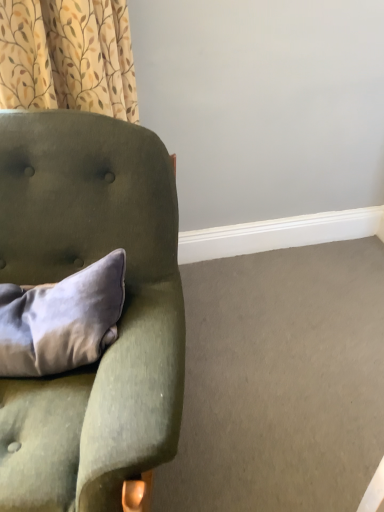
Measure the distance between point (73, 347) and camera.

38.54 inches.

At what (x,y) coordinates should I click in order to perform the action: click on satin gray pillow at left. Please return your answer as a coordinate pair (x, y). Looking at the image, I should click on (61, 320).

At what (x,y) coordinates should I click in order to perform the action: click on velvet green armchair at left. Please return your answer as a coordinate pair (x, y). The width and height of the screenshot is (384, 512). Looking at the image, I should click on (119, 320).

Which is more to the left, velvet green armchair at left or patterned fabric curtain at upper left?

From the viewer's perspective, velvet green armchair at left appears more on the left side.

You are a GUI agent. You are given a task and a screenshot of the screen. Output one action in this format:
    pyautogui.click(x=<x>, y=<y>)
    Task: Click on the curtain above the velvet green armchair at left (from a real-world perspective)
    
    Given the screenshot: What is the action you would take?
    pyautogui.click(x=67, y=56)

Can you confirm if velvet green armchair at left is shorter than patterned fabric curtain at upper left?

No.

Is velvet green armchair at left placed right next to patterned fabric curtain at upper left?

No, velvet green armchair at left is not making contact with patterned fabric curtain at upper left.

From the image's perspective, is velvet green armchair at left located above or below satin gray pillow at left?

Based on their image positions, velvet green armchair at left is located beneath satin gray pillow at left.

From a real-world perspective, between velvet green armchair at left and satin gray pillow at left, who is vertically higher?

satin gray pillow at left is physically above.

From their relative heights in the image, would you say velvet green armchair at left is taller or shorter than satin gray pillow at left?

Considering their sizes, velvet green armchair at left has more height than satin gray pillow at left.

Which object is closer to the camera taking this photo, velvet green armchair at left or satin gray pillow at left?

velvet green armchair at left.

From a real-world perspective, is patterned fabric curtain at upper left positioned under satin gray pillow at left based on gravity?

No.

Is patterned fabric curtain at upper left oriented away from satin gray pillow at left?

No, patterned fabric curtain at upper left's orientation is not away from satin gray pillow at left.

Can you tell me how much patterned fabric curtain at upper left and satin gray pillow at left differ in facing direction?

patterned fabric curtain at upper left and satin gray pillow at left are facing 16 degrees away from each other.

From the image's perspective, does patterned fabric curtain at upper left appear lower than satin gray pillow at left?

No, from the image's perspective, patterned fabric curtain at upper left is not beneath satin gray pillow at left.

Considering the sizes of satin gray pillow at left and velvet green armchair at left in the image, is satin gray pillow at left wider or thinner than velvet green armchair at left?

Clearly, satin gray pillow at left has less width compared to velvet green armchair at left.

From a real-world perspective, who is located higher, satin gray pillow at left or velvet green armchair at left?

In real-world perspective, satin gray pillow at left is above.

Does satin gray pillow at left have a larger size compared to velvet green armchair at left?

No.

Would you say satin gray pillow at left is a long distance from velvet green armchair at left?

That's not correct — satin gray pillow at left is a little close to velvet green armchair at left.

Between satin gray pillow at left and patterned fabric curtain at upper left, which one has larger size?

With larger size is patterned fabric curtain at upper left.

Is satin gray pillow at left taller or shorter than patterned fabric curtain at upper left?

In the image, satin gray pillow at left appears to be shorter than patterned fabric curtain at upper left.

Is satin gray pillow at left looking in the opposite direction of patterned fabric curtain at upper left?

satin gray pillow at left does not have its back to patterned fabric curtain at upper left.

Can you confirm if patterned fabric curtain at upper left is positioned to the right of velvet green armchair at left?

Yes.

Consider the image. Is patterned fabric curtain at upper left taller than velvet green armchair at left?

No, patterned fabric curtain at upper left is not taller than velvet green armchair at left.

Does patterned fabric curtain at upper left turn towards velvet green armchair at left?

No, patterned fabric curtain at upper left is not oriented towards velvet green armchair at left.

The width and height of the screenshot is (384, 512). I want to click on chair that appears below the patterned fabric curtain at upper left (from the image's perspective), so tap(119, 320).

Identify the location of pillow to the right of velvet green armchair at left. The width and height of the screenshot is (384, 512). (61, 320).

Considering their positions, is satin gray pillow at left positioned further to patterned fabric curtain at upper left than velvet green armchair at left?

satin gray pillow at left lies further to patterned fabric curtain at upper left than the other object.

Looking at this image, when comparing their distances from velvet green armchair at left, does satin gray pillow at left or patterned fabric curtain at upper left seem further?

patterned fabric curtain at upper left is positioned further to the anchor velvet green armchair at left.

Considering their positions, is patterned fabric curtain at upper left positioned closer to velvet green armchair at left than satin gray pillow at left?

satin gray pillow at left is closer to velvet green armchair at left.

Based on their spatial positions, is velvet green armchair at left or satin gray pillow at left further from patterned fabric curtain at upper left?

Based on the image, satin gray pillow at left appears to be further to patterned fabric curtain at upper left.

Looking at the image, which one is located closer to satin gray pillow at left, velvet green armchair at left or patterned fabric curtain at upper left?

velvet green armchair at left lies closer to satin gray pillow at left than the other object.

When comparing their distances from satin gray pillow at left, does patterned fabric curtain at upper left or velvet green armchair at left seem further?

Based on the image, patterned fabric curtain at upper left appears to be further to satin gray pillow at left.

This screenshot has width=384, height=512. Find the location of `pillow between patterned fabric curtain at upper left and velvet green armchair at left from top to bottom`. pillow between patterned fabric curtain at upper left and velvet green armchair at left from top to bottom is located at coordinates (61, 320).